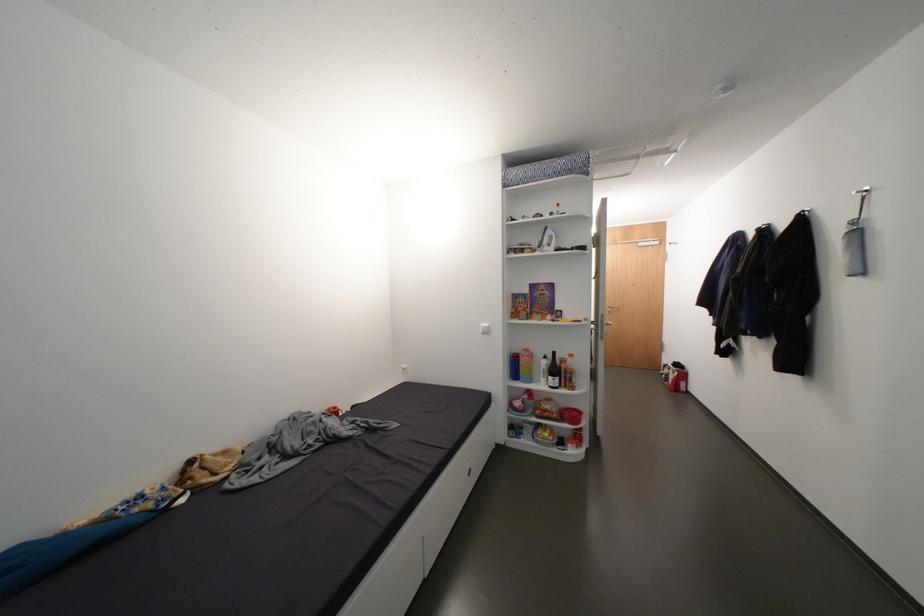
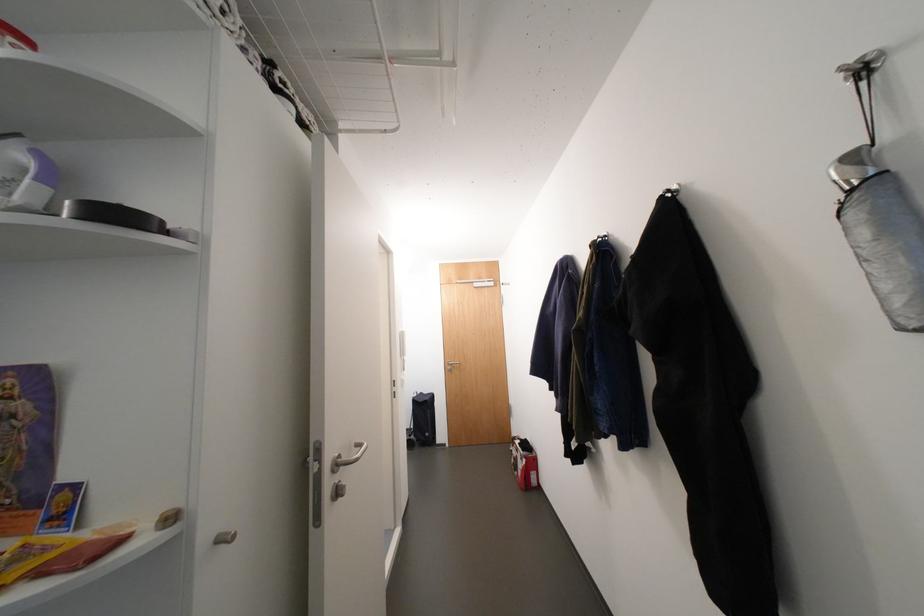
Where in the second image is the point corresponding to pixel 867 193 from the first image?

(855, 71)